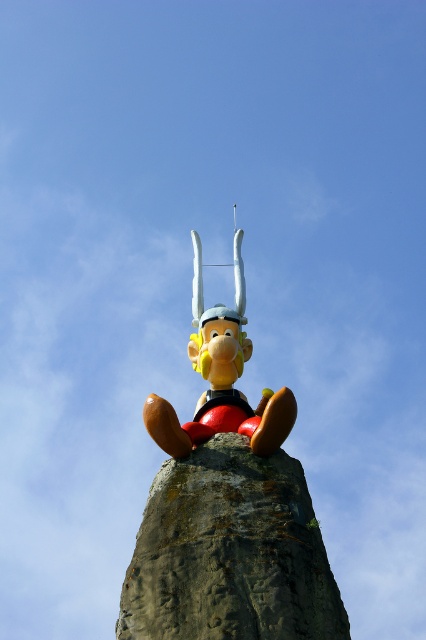
Question: Among these points, which one is farthest from the camera?

Choices:
 (A) (178, 536)
 (B) (161, 449)

Answer: (B)

Question: Which object is positioned closest to the matte plastic statue at center?

Choices:
 (A) shiny plastic statue at center
 (B) rusty stone monument at center

Answer: (B)

Question: Is rusty stone monument at center closer to camera compared to shiny plastic statue at center?

Choices:
 (A) no
 (B) yes

Answer: (B)

Question: Is rusty stone monument at center to the left of shiny plastic statue at center from the viewer's perspective?

Choices:
 (A) no
 (B) yes

Answer: (A)

Question: Does rusty stone monument at center appear on the left side of shiny plastic statue at center?

Choices:
 (A) no
 (B) yes

Answer: (A)

Question: Which point appears closest to the camera in this image?

Choices:
 (A) (236, 416)
 (B) (160, 486)
 (C) (238, 436)

Answer: (B)